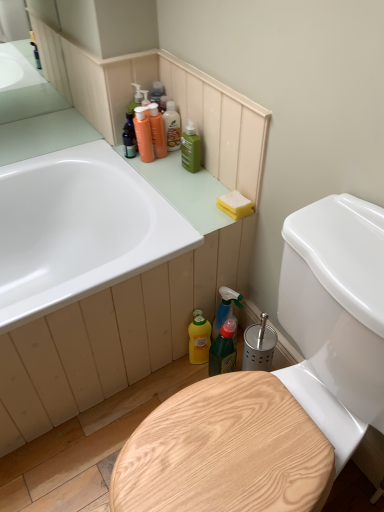
At what (x,y) coordinates should I click in order to perform the action: click on vacant space positioned to the left of translucent orange bottle at upper center, acting as the second cleaning product starting from the top. Please return your answer as a coordinate pair (x, y). This screenshot has height=512, width=384. Looking at the image, I should click on (111, 153).